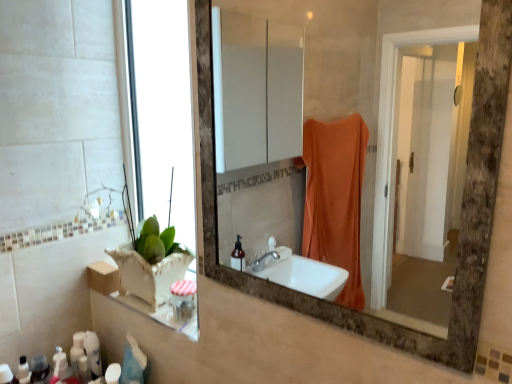
Question: Considering the relative sizes of matte white lotion at lower left, the 2th toiletry from the right, and matte brown mirror at center in the image provided, is matte white lotion at lower left, the 2th toiletry from the right, bigger than matte brown mirror at center?

Choices:
 (A) no
 (B) yes

Answer: (A)

Question: Is matte white lotion at lower left, the 1th toiletry in the left-to-right sequence, facing away from matte brown mirror at center?

Choices:
 (A) no
 (B) yes

Answer: (A)

Question: Does matte white lotion at lower left, the 1th toiletry in the left-to-right sequence, have a lesser height compared to matte brown mirror at center?

Choices:
 (A) yes
 (B) no

Answer: (A)

Question: Does matte white lotion at lower left, the 2th toiletry from the right, lie behind matte brown mirror at center?

Choices:
 (A) yes
 (B) no

Answer: (A)

Question: Does matte white lotion at lower left, the 2th toiletry from the right, turn towards matte brown mirror at center?

Choices:
 (A) no
 (B) yes

Answer: (A)

Question: From the image's perspective, is matte white lotion at lower left, the 2th toiletry from the right, located above matte brown mirror at center?

Choices:
 (A) no
 (B) yes

Answer: (A)

Question: Is matte white lotion at lower left, the 1th toiletry in the left-to-right sequence, wider than white matte bottle at lower left, positioned as the 1th toiletry in right-to-left order?

Choices:
 (A) no
 (B) yes

Answer: (B)

Question: Is matte white lotion at lower left, the 2th toiletry from the right, turned away from white matte bottle at lower left, placed as the 2th toiletry when sorted from left to right?

Choices:
 (A) yes
 (B) no

Answer: (B)

Question: Is matte white lotion at lower left, the 1th toiletry in the left-to-right sequence, smaller than white matte bottle at lower left, positioned as the 1th toiletry in right-to-left order?

Choices:
 (A) no
 (B) yes

Answer: (B)

Question: From a real-world perspective, is matte white lotion at lower left, the 2th toiletry from the right, below white matte bottle at lower left, placed as the 2th toiletry when sorted from left to right?

Choices:
 (A) yes
 (B) no

Answer: (A)

Question: Does matte white lotion at lower left, the 1th toiletry in the left-to-right sequence, turn towards white matte bottle at lower left, positioned as the 1th toiletry in right-to-left order?

Choices:
 (A) yes
 (B) no

Answer: (B)

Question: Is white matte bottle at lower left, positioned as the 1th toiletry in right-to-left order, inside matte white lotion at lower left, the 1th toiletry in the left-to-right sequence?

Choices:
 (A) no
 (B) yes

Answer: (A)

Question: Is matte brown mirror at center completely or partially inside white matte bottle at lower left, placed as the 2th toiletry when sorted from left to right?

Choices:
 (A) yes
 (B) no

Answer: (B)